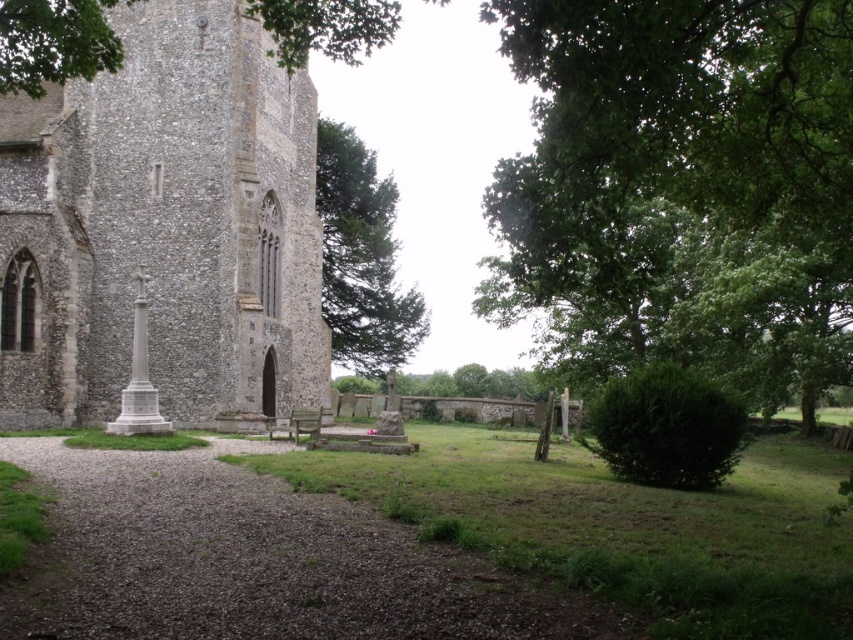
Who is more distant from viewer, [392,248] or [293,436]?

Point [392,248]

Looking at this image, between green leafy tree at center and wooden park bench at center, which one appears on the right side from the viewer's perspective?

Positioned to the right is green leafy tree at center.

Who is more distant from viewer, (364,292) or (318,428)?

Point (364,292)

I want to click on green leafy tree at center, so click(x=361, y=257).

Between green leafy tree at right and stone church at left, which one has more height?

Standing taller between the two is green leafy tree at right.

Describe the element at coordinates (682, 188) in the screenshot. I see `green leafy tree at right` at that location.

The image size is (853, 640). Identify the location of green leafy tree at right. (682, 188).

Between green leafy tree at center and green leafy tree at upper left, which one is positioned lower?

Positioned lower is green leafy tree at center.

Who is more forward, (x=341, y=332) or (x=368, y=29)?

Point (x=368, y=29) is more forward.

Where is `green leafy tree at center`? green leafy tree at center is located at coordinates (361, 257).